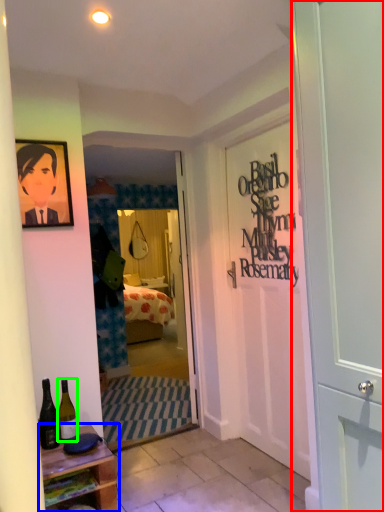
Question: Based on their relative distances, which object is nearer to door (highlighted by a red box)? Choose from table (highlighted by a blue box) and bottle (highlighted by a green box).

Choices:
 (A) table
 (B) bottle

Answer: (A)